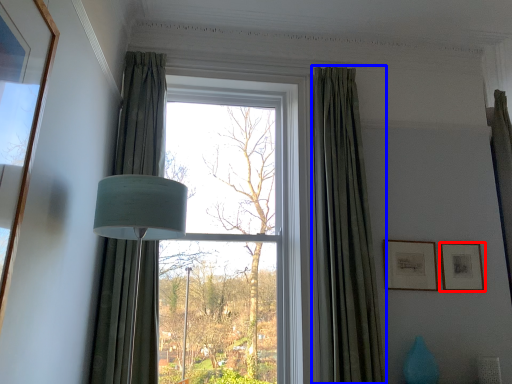
Question: Which object appears farthest to the camera in this image, picture frame (highlighted by a red box) or curtain (highlighted by a blue box)?

Choices:
 (A) picture frame
 (B) curtain

Answer: (A)